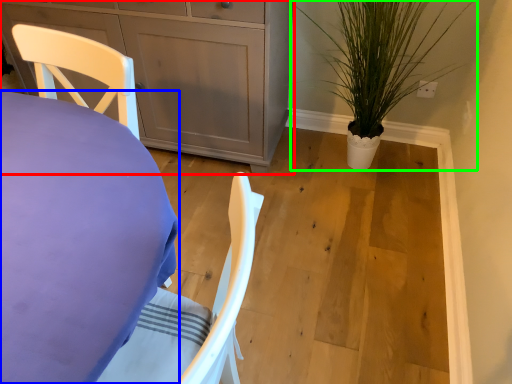
Question: Based on their relative distances, which object is nearer to cabinetry (highlighted by a red box)? Choose from desk (highlighted by a blue box) and houseplant (highlighted by a green box).

Choices:
 (A) desk
 (B) houseplant

Answer: (B)